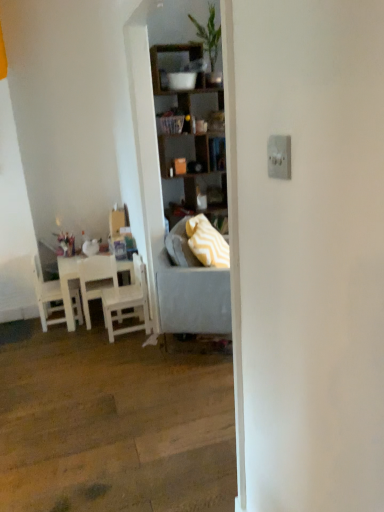
Where is `free spot below white wood chair at left, which is counted as the 3th chair, starting from the left (from a real-world perspective)`? This screenshot has height=512, width=384. free spot below white wood chair at left, which is counted as the 3th chair, starting from the left (from a real-world perspective) is located at coordinates (124, 328).